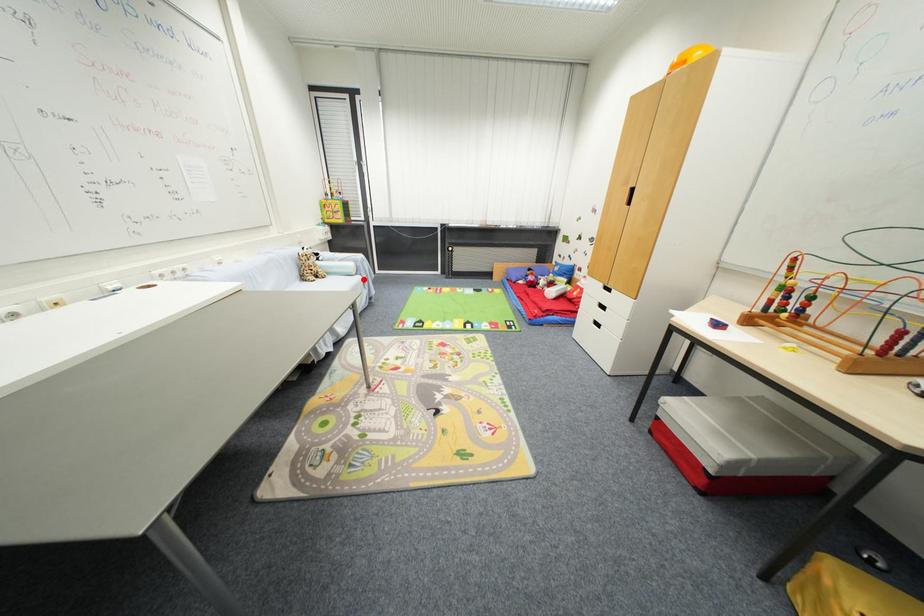
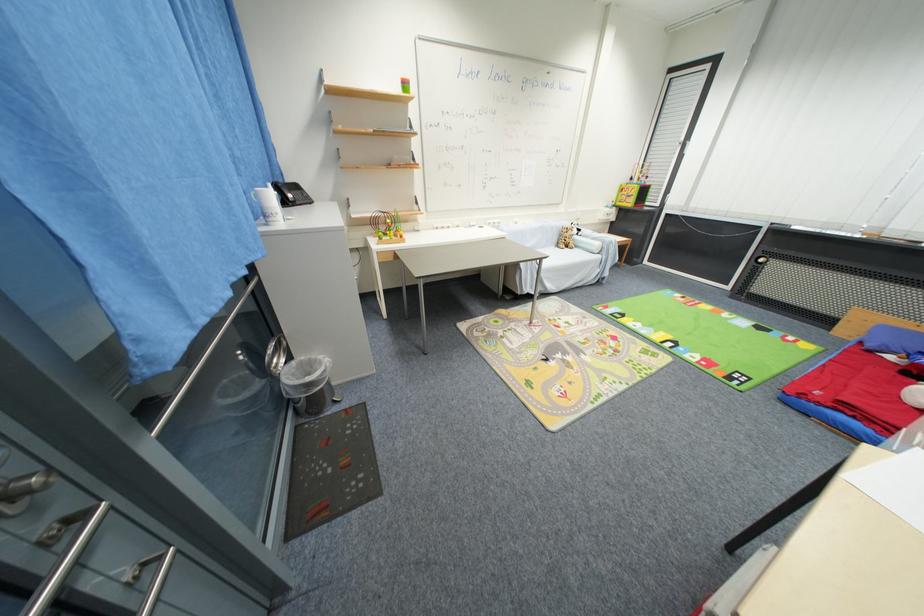
The point at the highlighted location is marked in the first image. Where is the corresponding point in the second image?

(603, 259)